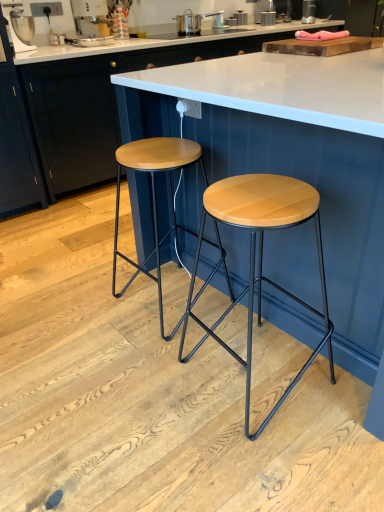
Question: Does wooden table at center contain metallic silver toaster at upper center, the 2th appliance in the bottom-to-top sequence?

Choices:
 (A) no
 (B) yes

Answer: (A)

Question: Is wooden table at center bigger than metallic silver toaster at upper center, arranged as the first appliance when viewed from the right?

Choices:
 (A) no
 (B) yes

Answer: (B)

Question: Considering the relative sizes of wooden table at center and metallic silver toaster at upper center, which appears as the 1th appliance when viewed from the top, in the image provided, is wooden table at center shorter than metallic silver toaster at upper center, which appears as the 1th appliance when viewed from the top,?

Choices:
 (A) no
 (B) yes

Answer: (A)

Question: Is wooden table at center completely or partially outside of metallic silver toaster at upper center, which ranks as the 2th appliance in front-to-back order?

Choices:
 (A) no
 (B) yes

Answer: (B)

Question: Is wooden table at center positioned behind metallic silver toaster at upper center, the first appliance positioned from the back?

Choices:
 (A) yes
 (B) no

Answer: (B)

Question: Is wooden table at center at the right side of metallic silver toaster at upper center, the 2th appliance in the bottom-to-top sequence?

Choices:
 (A) no
 (B) yes

Answer: (A)

Question: Is the surface of wooden stool at center, which is the first stool in right-to-left order, in direct contact with matte white countertop at center?

Choices:
 (A) yes
 (B) no

Answer: (B)

Question: From a real-world perspective, is wooden stool at center, the second stool viewed from the left, below matte white countertop at center?

Choices:
 (A) yes
 (B) no

Answer: (A)

Question: Is wooden stool at center, the second stool viewed from the left, oriented towards matte white countertop at center?

Choices:
 (A) no
 (B) yes

Answer: (A)

Question: Does wooden stool at center, the second stool viewed from the left, have a greater height compared to matte white countertop at center?

Choices:
 (A) yes
 (B) no

Answer: (B)

Question: Can you confirm if wooden stool at center, the second stool viewed from the left, is positioned to the right of matte white countertop at center?

Choices:
 (A) no
 (B) yes

Answer: (B)

Question: From a real-world perspective, is wooden stool at center, the second stool viewed from the left, physically above matte white countertop at center?

Choices:
 (A) yes
 (B) no

Answer: (B)

Question: From the image's perspective, is metallic silver coffee machine at upper left, which is the 2th appliance in right-to-left order, on top of metallic silver toaster at upper center, which ranks as the 2th appliance in front-to-back order?

Choices:
 (A) yes
 (B) no

Answer: (B)